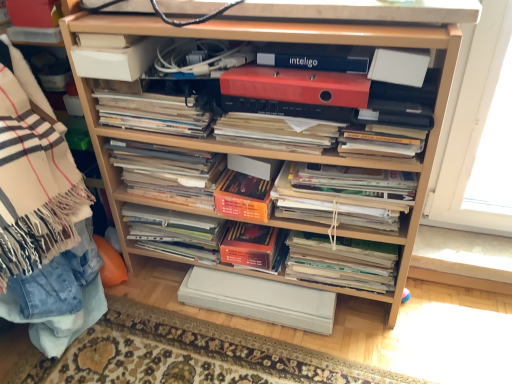
How much space does matte paper magazine at lower center, which appears as the first magazine when ordered from the bottom, occupy horizontally?

matte paper magazine at lower center, which appears as the first magazine when ordered from the bottom, is 3.97 inches wide.

Measure the distance between point (x=347, y=247) and camera.

Point (x=347, y=247) is 1.20 meters from camera.

What do you see at coordinates (42, 219) in the screenshot? I see `wooden shelf at left` at bounding box center [42, 219].

This screenshot has height=384, width=512. Describe the element at coordinates (314, 62) in the screenshot. I see `blue matte inteligo at upper center, which appears as the sixth paperback book when ordered from the bottom` at that location.

In order to click on white matte paper at upper left, the seventh paperback book positioned from the bottom in this screenshot , I will do `click(116, 60)`.

You are a GUI agent. You are given a task and a screenshot of the screen. Output one action in this format:
    pyautogui.click(x=<x>, y=<y>)
    Task: Click on the matte orange paperback book at center, which appears as the seventh paperback book when viewed from the top
    Image resolution: width=512 pixels, height=384 pixels.
    Given the screenshot: What is the action you would take?
    pyautogui.click(x=259, y=299)

Locate an element on the screen. Image resolution: width=512 pixels, height=384 pixels. wooden shelf at center is located at coordinates (256, 148).

The image size is (512, 384). Find the location of `matte paper magazine at lower center, the 7th magazine from the top`. matte paper magazine at lower center, the 7th magazine from the top is located at coordinates (342, 262).

From the image's perspective, is wooden shelf at center on top of matte red folder at center, the 3th paperback book from the top?

No.

Is wooden shelf at center inside the boundaries of matte red folder at center, the 3th paperback book from the top, or outside?

wooden shelf at center exists outside the volume of matte red folder at center, the 3th paperback book from the top.

Based on the photo, considering the relative sizes of wooden shelf at center and matte red folder at center, the 5th paperback book when ordered from bottom to top, in the image provided, is wooden shelf at center shorter than matte red folder at center, the 5th paperback book when ordered from bottom to top,?

No, wooden shelf at center is not shorter than matte red folder at center, the 5th paperback book when ordered from bottom to top.

Does point (434, 153) come behind point (234, 88)?

Yes, it is behind point (234, 88).

In terms of width, does matte cardboard magazine at center, the sixth magazine viewed from the top, look wider or thinner when compared to orange matte paperback book at center, which is the 6th paperback book in top-to-bottom order?

Clearly, matte cardboard magazine at center, the sixth magazine viewed from the top, has less width compared to orange matte paperback book at center, which is the 6th paperback book in top-to-bottom order.

Can you confirm if matte cardboard magazine at center, which appears as the second magazine when ordered from the bottom, is shorter than orange matte paperback book at center, which is the 6th paperback book in top-to-bottom order?

In fact, matte cardboard magazine at center, which appears as the second magazine when ordered from the bottom, may be taller than orange matte paperback book at center, which is the 6th paperback book in top-to-bottom order.

Considering the sizes of objects matte cardboard magazine at center, which appears as the second magazine when ordered from the bottom, and orange matte paperback book at center, which is the 2th paperback book from bottom to top, in the image provided, who is smaller, matte cardboard magazine at center, which appears as the second magazine when ordered from the bottom, or orange matte paperback book at center, which is the 2th paperback book from bottom to top,?

orange matte paperback book at center, which is the 2th paperback book from bottom to top.

Considering the positions of objects matte cardboard magazine at center, the sixth magazine viewed from the top, and orange matte paperback book at center, which is the 6th paperback book in top-to-bottom order, in the image provided, who is more to the right, matte cardboard magazine at center, the sixth magazine viewed from the top, or orange matte paperback book at center, which is the 6th paperback book in top-to-bottom order,?

From the viewer's perspective, orange matte paperback book at center, which is the 6th paperback book in top-to-bottom order, appears more on the right side.

Is matte cardboard magazine at center, the fourth magazine from the top, positioned far away from matte paper magazine at lower center, which appears as the first magazine when ordered from the bottom?

Actually, matte cardboard magazine at center, the fourth magazine from the top, and matte paper magazine at lower center, which appears as the first magazine when ordered from the bottom, are a little close together.

Is point (148, 145) positioned in front of point (305, 239)?

Yes, it is.

Does matte cardboard magazine at center, the fourth magazine from the top, have a greater height compared to matte paper magazine at lower center, the 7th magazine from the top?

Yes.

From the image's perspective, which is below, matte cardboard magazine at center, the 4th magazine in the bottom-to-top sequence, or matte paper magazine at lower center, the 7th magazine from the top?

matte paper magazine at lower center, the 7th magazine from the top, appears lower in the image.

Is white matte paper at upper left, the seventh paperback book positioned from the bottom, at the back of wooden shelf at center?

Yes, wooden shelf at center is positioned with its back facing white matte paper at upper left, the seventh paperback book positioned from the bottom.

Which of these two, wooden shelf at center or white matte paper at upper left, the seventh paperback book positioned from the bottom, stands taller?

With more height is wooden shelf at center.

From a real-world perspective, is wooden shelf at center beneath white matte paper at upper left, the first paperback book in the top-to-bottom sequence?

Correct, in the physical world, wooden shelf at center is lower than white matte paper at upper left, the first paperback book in the top-to-bottom sequence.

Considering the relative sizes of matte cardboard magazine at center, the fourth magazine from the top, and white matte paper at upper left, the seventh paperback book positioned from the bottom, in the image provided, is matte cardboard magazine at center, the fourth magazine from the top, smaller than white matte paper at upper left, the seventh paperback book positioned from the bottom,?

No.

How many degrees apart are the facing directions of matte cardboard magazine at center, the fourth magazine from the top, and white matte paper at upper left, the seventh paperback book positioned from the bottom?

0.00255 degrees.

Could you measure the distance between matte cardboard magazine at center, the 4th magazine in the bottom-to-top sequence, and white matte paper at upper left, the first paperback book in the top-to-bottom sequence?

The distance of matte cardboard magazine at center, the 4th magazine in the bottom-to-top sequence, from white matte paper at upper left, the first paperback book in the top-to-bottom sequence, is 11.10 inches.

From a real-world perspective, is matte cardboard magazine at center, the 4th magazine in the bottom-to-top sequence, over white matte paper at upper left, the seventh paperback book positioned from the bottom?

No, from a real-world perspective, matte cardboard magazine at center, the 4th magazine in the bottom-to-top sequence, is not on top of white matte paper at upper left, the seventh paperback book positioned from the bottom.

Would you say white paper magazine at center, placed as the first magazine when sorted from top to bottom, is inside or outside matte cardboard magazine at center, the fourth magazine from the top?

white paper magazine at center, placed as the first magazine when sorted from top to bottom, is not enclosed by matte cardboard magazine at center, the fourth magazine from the top.

Between white paper magazine at center, placed as the first magazine when sorted from top to bottom, and matte cardboard magazine at center, the fourth magazine from the top, which one has larger size?

With larger size is matte cardboard magazine at center, the fourth magazine from the top.

Is white paper magazine at center, which is the seventh magazine in bottom-to-top order, positioned in front of matte cardboard magazine at center, the 4th magazine in the bottom-to-top sequence?

Yes, white paper magazine at center, which is the seventh magazine in bottom-to-top order, is in front of matte cardboard magazine at center, the 4th magazine in the bottom-to-top sequence.

Which is more to the right, white paper magazine at center, which is the seventh magazine in bottom-to-top order, or matte cardboard magazine at center, the 4th magazine in the bottom-to-top sequence?

white paper magazine at center, which is the seventh magazine in bottom-to-top order.

Locate an element on the screen. the 2nd paperback book behind the blue matte inteligo at upper center, which appears as the sixth paperback book when ordered from the bottom, counting from the anchor's position is located at coordinates (243, 197).

Which object is further away from the camera taking this photo, blue matte inteligo at upper center, which appears as the sixth paperback book when ordered from the bottom, or orange matte paperback book at center, placed as the 3th paperback book when sorted from bottom to top?

orange matte paperback book at center, placed as the 3th paperback book when sorted from bottom to top.

From a real-world perspective, is blue matte inteligo at upper center, which appears as the second paperback book when viewed from the top, on top of orange matte paperback book at center, arranged as the fifth paperback book when viewed from the top?

Yes, from a real-world perspective, blue matte inteligo at upper center, which appears as the second paperback book when viewed from the top, is over orange matte paperback book at center, arranged as the fifth paperback book when viewed from the top

Based on the photo, can you confirm if blue matte inteligo at upper center, which appears as the sixth paperback book when ordered from the bottom, is bigger than orange matte paperback book at center, placed as the 3th paperback book when sorted from bottom to top?

No.

You are a GUI agent. You are given a task and a screenshot of the screen. Output one action in this format:
    pyautogui.click(x=<x>, y=<y>)
    Task: Click on the 2nd paperback book behind the wooden shelf at center, counting from the anchor's position
    This screenshot has width=512, height=384.
    Given the screenshot: What is the action you would take?
    pyautogui.click(x=296, y=86)

Find the location of a particular element. This screenshot has height=384, width=512. the 2nd paperback book counting from the right side of the matte cardboard magazine at center, which appears as the second magazine when ordered from the bottom is located at coordinates (251, 245).

From the image, which object appears to be nearer to wooden shelf at center, matte orange paperback book at center, which appears as the 1th paperback book when ordered from the bottom, or matte red folder at center, the 3th paperback book from the top?

matte red folder at center, the 3th paperback book from the top, is closer to wooden shelf at center.

From the image, which object appears to be farther from matte paper magazine at upper right, positioned as the fifth magazine in bottom-to-top order, white matte paper at upper right, marked as the 4th paperback book in a bottom-to-top arrangement, or orange matte paperback book at center, arranged as the fifth paperback book when viewed from the top?

Based on the image, orange matte paperback book at center, arranged as the fifth paperback book when viewed from the top, appears to be further to matte paper magazine at upper right, positioned as the fifth magazine in bottom-to-top order.

Considering their positions, is orange matte paperback book at center, arranged as the fifth paperback book when viewed from the top, positioned further to wooden shelf at left than orange matte paperback book at center, which is the 6th paperback book in top-to-bottom order?

orange matte paperback book at center, which is the 6th paperback book in top-to-bottom order, is positioned further to the anchor wooden shelf at left.

Looking at the image, which one is located closer to white matte paper at upper right, marked as the 4th paperback book in a bottom-to-top arrangement, white matte paper at upper left, the seventh paperback book positioned from the bottom, or matte cardboard magazine at center, which appears as the second magazine when ordered from the bottom?

white matte paper at upper left, the seventh paperback book positioned from the bottom, lies closer to white matte paper at upper right, marked as the 4th paperback book in a bottom-to-top arrangement, than the other object.

When comparing their distances from matte cardboard magazine at center, the 4th magazine in the bottom-to-top sequence, does matte black magazine at center, which is the second magazine from top to bottom, or blue matte inteligo at upper center, which appears as the sixth paperback book when ordered from the bottom, seem further?

Among the two, blue matte inteligo at upper center, which appears as the sixth paperback book when ordered from the bottom, is located further to matte cardboard magazine at center, the 4th magazine in the bottom-to-top sequence.

Based on their spatial positions, is wooden shelf at center or matte orange paperback book at center, which appears as the seventh paperback book when viewed from the top, closer to white paper magazine at center, positioned as the third magazine in bottom-to-top order?

The object closer to white paper magazine at center, positioned as the third magazine in bottom-to-top order, is wooden shelf at center.

Looking at the image, which one is located further to orange matte paperback book at center, which is the 2th paperback book from bottom to top, matte paper magazine at upper right, positioned as the third magazine in top-to-bottom order, or matte cardboard magazine at center, the 4th magazine in the bottom-to-top sequence?

matte paper magazine at upper right, positioned as the third magazine in top-to-bottom order, is further to orange matte paperback book at center, which is the 2th paperback book from bottom to top.

Estimate the real-world distances between objects in this image. Which object is closer to wooden shelf at left, matte paper magazine at upper right, positioned as the fifth magazine in bottom-to-top order, or wooden shelf at center?

wooden shelf at center is positioned closer to the anchor wooden shelf at left.

You are a GUI agent. You are given a task and a screenshot of the screen. Output one action in this format:
    pyautogui.click(x=<x>, y=<y>)
    Task: Click on the shelf between matte red folder at center, the 5th paperback book when ordered from bottom to top, and matte orange paperback book at center, which appears as the 1th paperback book when ordered from the bottom, from top to bottom
    
    Given the screenshot: What is the action you would take?
    pyautogui.click(x=256, y=148)

Where is `paperback book that lies between white paper magazine at center, placed as the first magazine when sorted from top to bottom, and orange matte paperback book at center, which is the 6th paperback book in top-to-bottom order, from top to bottom`? This screenshot has width=512, height=384. paperback book that lies between white paper magazine at center, placed as the first magazine when sorted from top to bottom, and orange matte paperback book at center, which is the 6th paperback book in top-to-bottom order, from top to bottom is located at coordinates (243, 197).

Locate an element on the screen. Image resolution: width=512 pixels, height=384 pixels. shelf between blue matte inteligo at upper center, which appears as the second paperback book when viewed from the top, and orange matte paperback book at center, placed as the 3th paperback book when sorted from bottom to top, vertically is located at coordinates (256, 148).

Find the location of a particular element. The height and width of the screenshot is (384, 512). shelf between white paper magazine at center, which is the seventh magazine in bottom-to-top order, and matte orange paperback book at center, which appears as the seventh paperback book when viewed from the top, from top to bottom is located at coordinates [x=256, y=148].